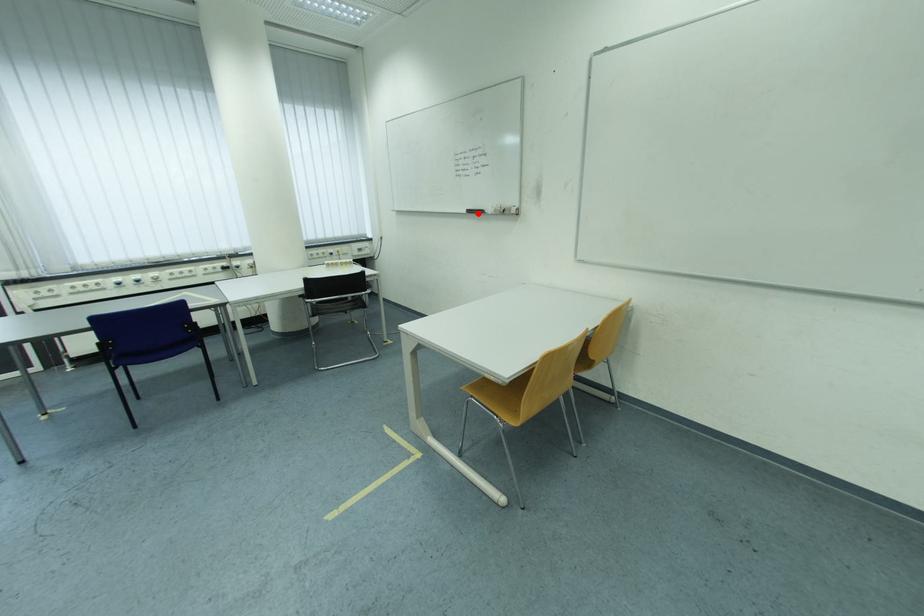
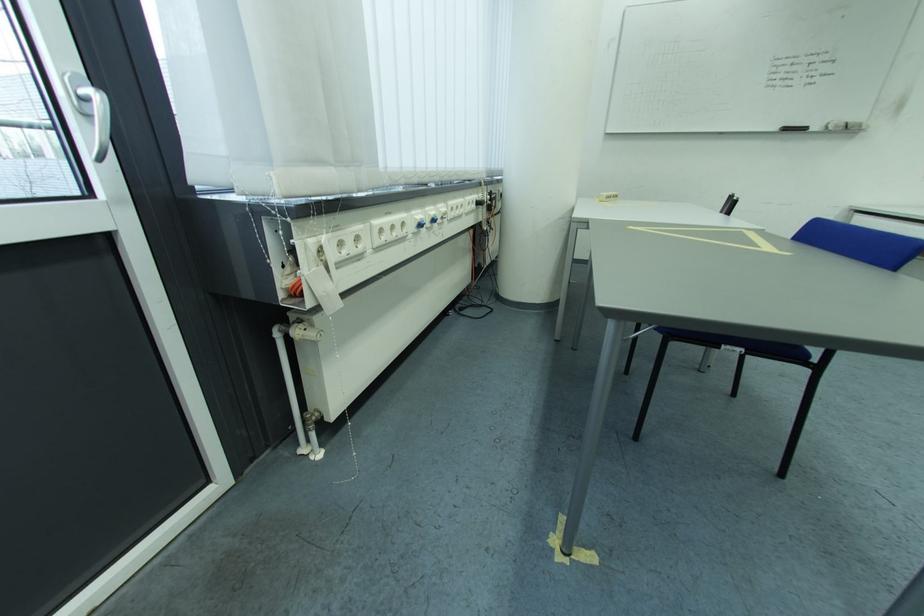
Locate, in the second image, the point that corresponds to the highlighted location in the first image.

(796, 131)